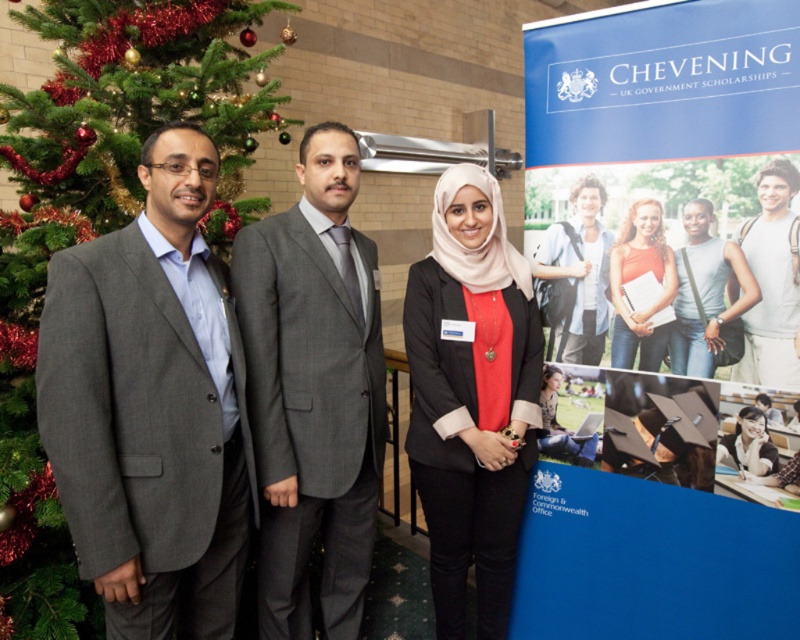
Question: Which point is closer to the camera?

Choices:
 (A) gray cotton t-shirt at center
 (B) green textured christmas tree at left
 (C) matte orange tank top at center

Answer: (B)

Question: Considering the real-world distances, which object is farthest from the gray wool suit at center?

Choices:
 (A) matte gray tank top at center
 (B) matte black laptop at center
 (C) matte orange tank top at center

Answer: (B)

Question: Is gray woolen suit at left above light blue denim shirt at center?

Choices:
 (A) no
 (B) yes

Answer: (A)

Question: Which point is farther to the camera?

Choices:
 (A) matte black laptop at center
 (B) gray cotton t-shirt at center
 (C) matte orange tank top at center
 (D) green textured christmas tree at left

Answer: (C)

Question: Can you confirm if green textured christmas tree at left is positioned below matte black blazer at center?

Choices:
 (A) no
 (B) yes

Answer: (A)

Question: Is light blue denim shirt at center thinner than matte black laptop at center?

Choices:
 (A) no
 (B) yes

Answer: (A)